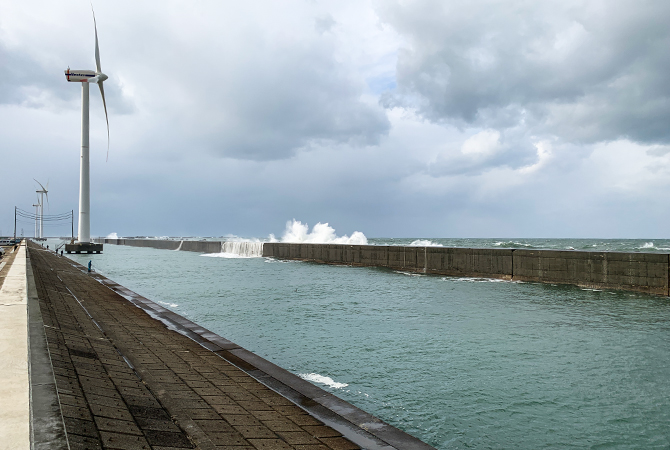
Find the location of a particular element. Image resolution: width=670 pixels, height=450 pixels. ledge is located at coordinates (21, 354).